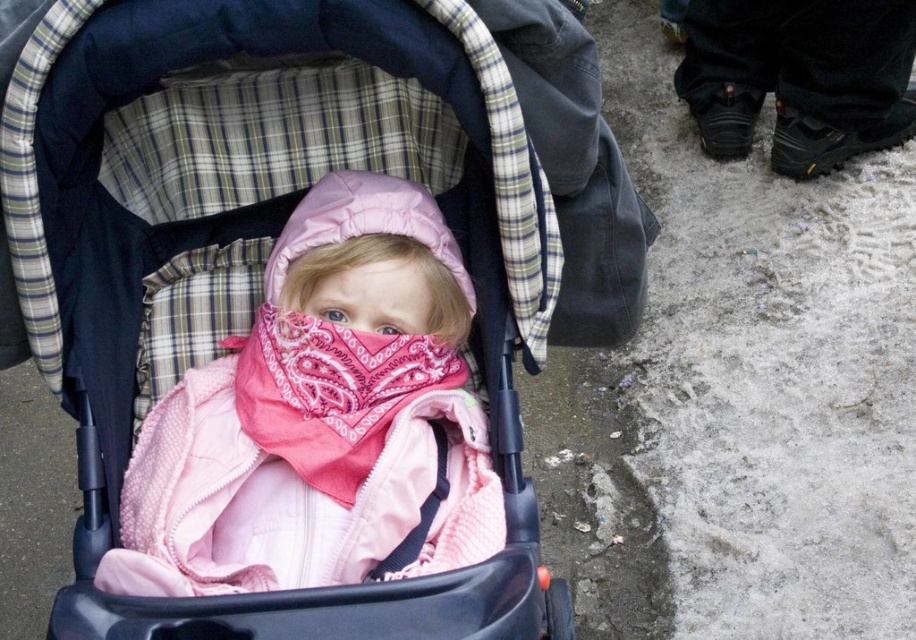
Question: Which of these objects is positioned farthest from the pink paisley scarf at center?

Choices:
 (A) matte pink fabric baby carriage at center
 (B) pink quilted jacket at center

Answer: (A)

Question: Is matte pink fabric baby carriage at center above pink quilted jacket at center?

Choices:
 (A) no
 (B) yes

Answer: (B)

Question: Which object is farther from the camera taking this photo?

Choices:
 (A) pink quilted jacket at center
 (B) matte pink fabric baby carriage at center
 (C) pink paisley scarf at center

Answer: (C)

Question: Is matte pink fabric baby carriage at center thinner than pink quilted jacket at center?

Choices:
 (A) yes
 (B) no

Answer: (B)

Question: Which is nearer to the pink paisley scarf at center?

Choices:
 (A) pink quilted jacket at center
 (B) matte pink fabric baby carriage at center

Answer: (A)

Question: Where is pink quilted jacket at center located in relation to pink paisley scarf at center in the image?

Choices:
 (A) above
 (B) below

Answer: (B)